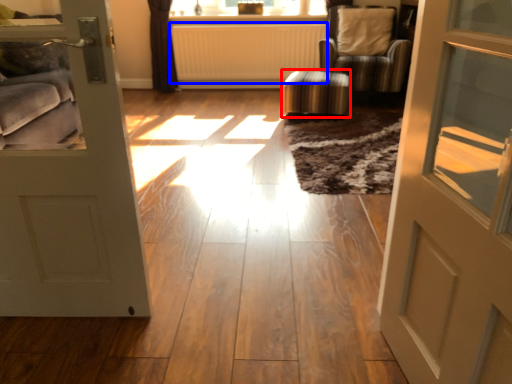
Question: Which of the following is the closest to the observer, stool (highlighted by a red box) or radiator (highlighted by a blue box)?

Choices:
 (A) stool
 (B) radiator

Answer: (A)